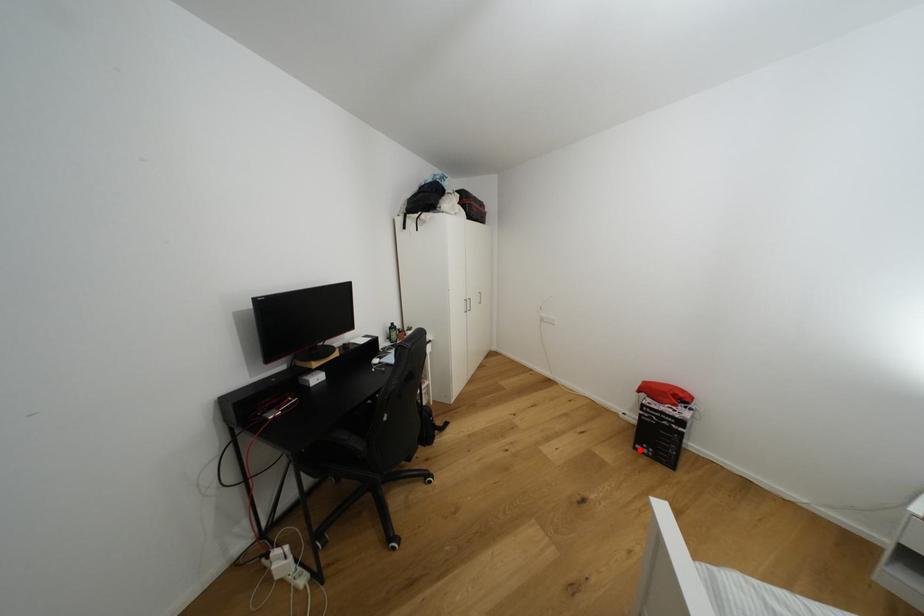
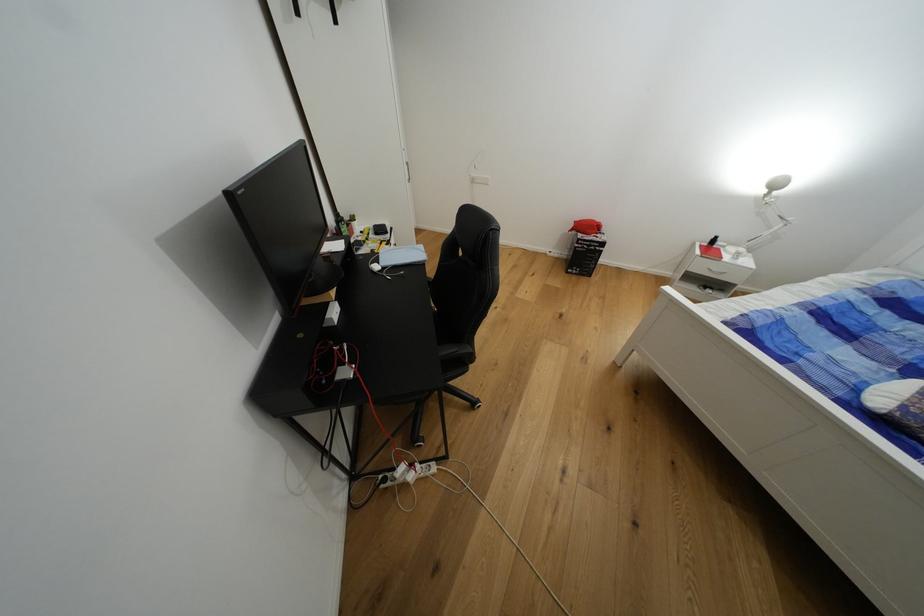
Find the pixel in the second image that matches the highlighted location in the first image.

(573, 274)